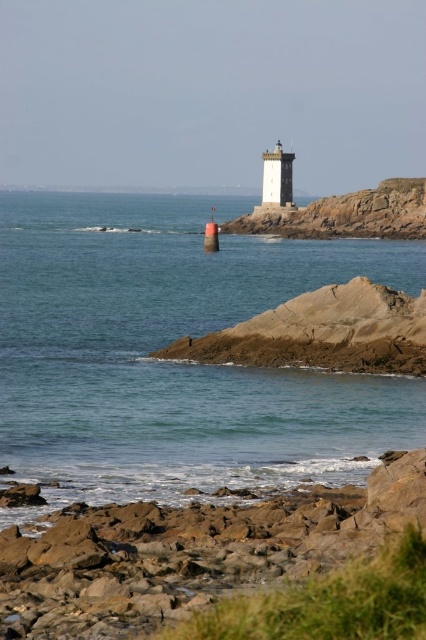
Based on the provided scene description, where is the clear blue water at center positioned in relation to the lighthouse and the rocky shoreline?

The clear blue water at center is located at point coordinates of 0.566 on the x axis and 0.415 on the y axis.

You are a photographer planning to capture the lighthouse and its surroundings. You want to ensure that both the clear blue water at center and the brown rock cliff at center are visible in your shot. Based on their sizes, which of these two elements will occupy more of the frame?

The clear blue water at center is larger in size than the brown rock cliff at center, so it will occupy more of the frame in the photograph.

Consider the image. You are a hiker trying to cross from the lower left to the center of the image. You see the brown rough rocks at lower left and the brown rock cliff at center. Which path is narrower between the two?

The brown rough rocks at lower left is thinner than the brown rock cliff at center, so the path through the brown rough rocks at lower left is narrower.